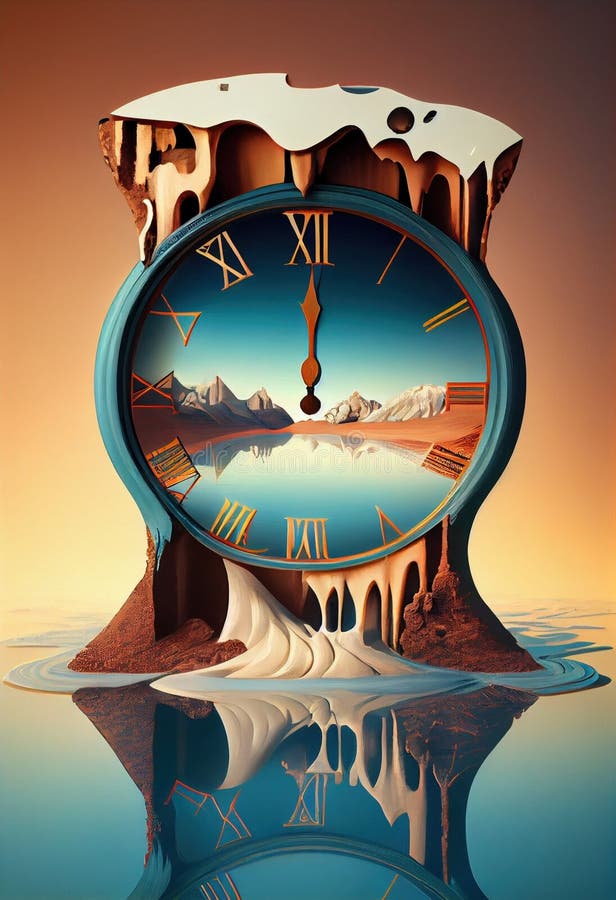
At what (x,y) coordinates should I click in order to perform the action: click on 1 clock. Please return your answer as a coordinate pair (x, y). Looking at the image, I should click on (248, 325).